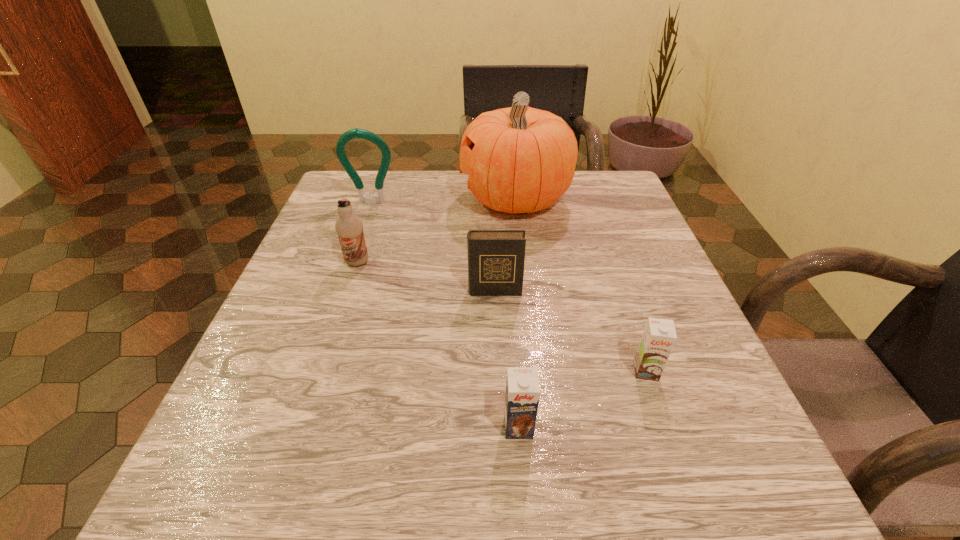
In order to click on object that can be found as the fourth closest to the nearest object in this screenshot , I will do `click(519, 159)`.

Identify the location of chocolate milk that is the second closest to the pumpkin. This screenshot has height=540, width=960. (659, 336).

Where is `chocolate milk that can be found as the closest to the fifth farthest object`? chocolate milk that can be found as the closest to the fifth farthest object is located at coordinates (522, 387).

Locate an element on the screen. free space that satisfies the following two spatial constraints: 1. at the jaws of the second farthest chocolate milk; 2. on the left side of the second tallest object is located at coordinates (313, 371).

Identify the location of free space that satisfies the following two spatial constraints: 1. on the front-facing side of the tallest object; 2. on the left side of the fifth farthest object. (536, 371).

This screenshot has width=960, height=540. Find the location of `vacant space that satisfies the following two spatial constraints: 1. on the front cover of the diary; 2. on the left side of the fifth farthest object`. vacant space that satisfies the following two spatial constraints: 1. on the front cover of the diary; 2. on the left side of the fifth farthest object is located at coordinates (498, 371).